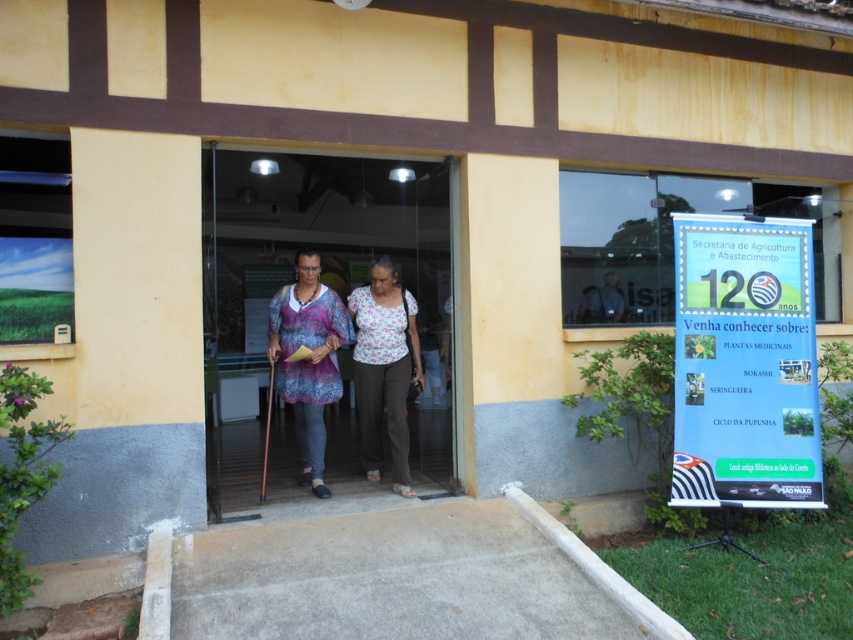
Question: Which object is closer to the camera taking this photo?

Choices:
 (A) matte purple dress at center
 (B) wooden door at center

Answer: (A)

Question: Can you confirm if wooden door at center is smaller than matte purple dress at center?

Choices:
 (A) no
 (B) yes

Answer: (B)

Question: Does floral fabric blouse at center have a greater width compared to dark blue shirt at center?

Choices:
 (A) no
 (B) yes

Answer: (A)

Question: Which point is farther from the camera taking this photo?

Choices:
 (A) (372, 298)
 (B) (309, 468)
 (C) (612, 289)

Answer: (C)

Question: Which point is closer to the camera?

Choices:
 (A) floral fabric blouse at center
 (B) wooden door at center

Answer: (A)

Question: Where is matte purple dress at center located in relation to floral fabric blouse at center in the image?

Choices:
 (A) above
 (B) below

Answer: (A)